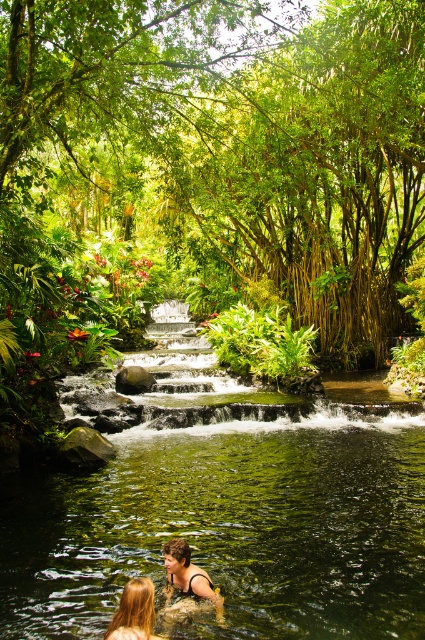
Question: Can you confirm if blonde hair at lower center is thinner than smooth brown hair at lower center?

Choices:
 (A) no
 (B) yes

Answer: (B)

Question: Is green leafy river at center above blonde hair at lower center?

Choices:
 (A) no
 (B) yes

Answer: (B)

Question: Estimate the real-world distances between objects in this image. Which object is farther from the smooth brown hair at lower center?

Choices:
 (A) blonde hair at lower center
 (B) green leafy river at center

Answer: (B)

Question: Which point is closer to the camera?

Choices:
 (A) (110, 636)
 (B) (167, 572)

Answer: (A)

Question: Does blonde hair at lower center appear on the right side of smooth brown hair at lower center?

Choices:
 (A) yes
 (B) no

Answer: (B)

Question: Estimate the real-world distances between objects in this image. Which object is closer to the blonde hair at lower center?

Choices:
 (A) green leafy river at center
 (B) smooth brown hair at lower center

Answer: (B)